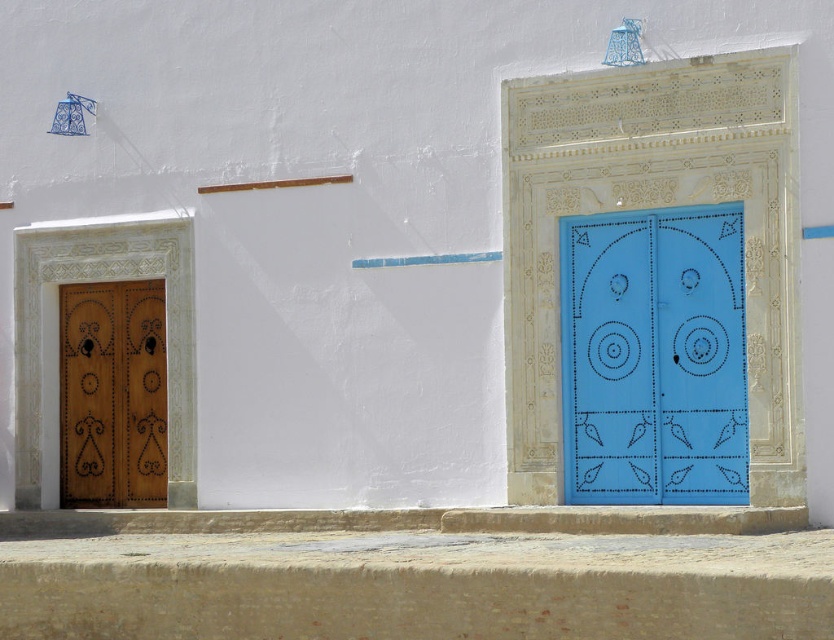
You are standing in front of a wall with two doors. You need to locate the blue painted wood door at right. According to the coordinates provided, where exactly is it positioned?

The blue painted wood door at right is positioned at coordinates point [652,356].

You are standing in a hallway facing two doors. The blue painted wood door at right and the wooden door at left are both visible. Which door would you need to walk towards if you want to exit through the one that is closer to you?

The blue painted wood door at right is in front of the wooden door at left, so it is closer to you. Therefore, you should walk towards the blue painted wood door at right to exit through the closer one.

You are an architect designing a new hallway. You need to place a 3.5 meter long sculpture between the blue painted wood door at right and the wooden door at left. Will there be enough space between them to accommodate the sculpture?

The blue painted wood door at right and wooden door at left are 5.04 meters apart, so yes, the 3.5 meter long sculpture can be placed between them since the distance between the doors is greater than the sculpture length.